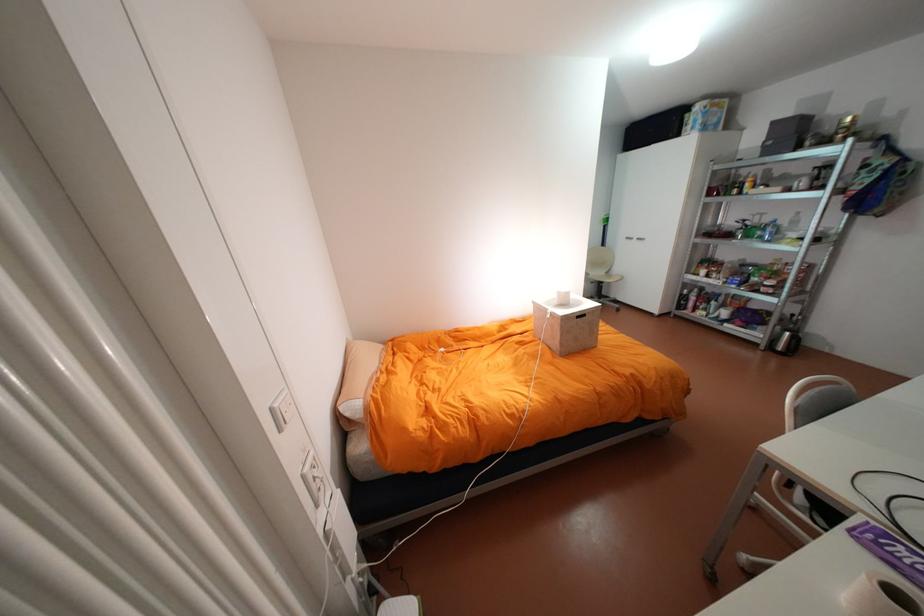
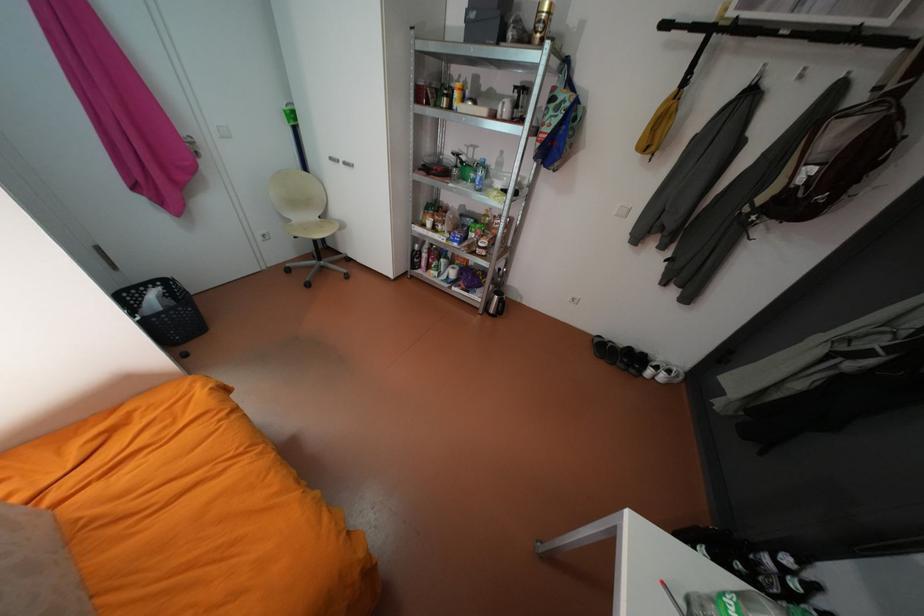
Locate, in the second image, the point that corresponds to (x=834, y=140) in the first image.

(533, 39)